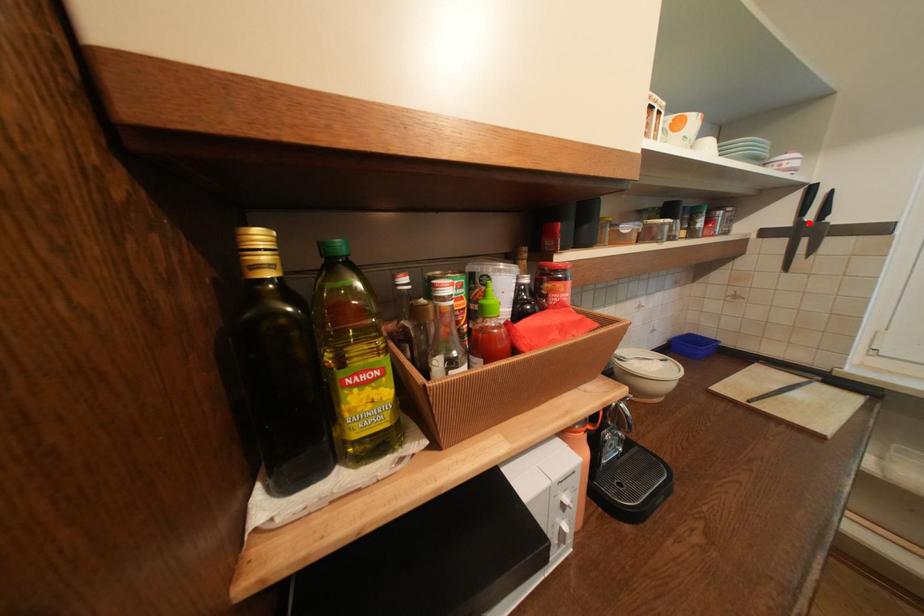
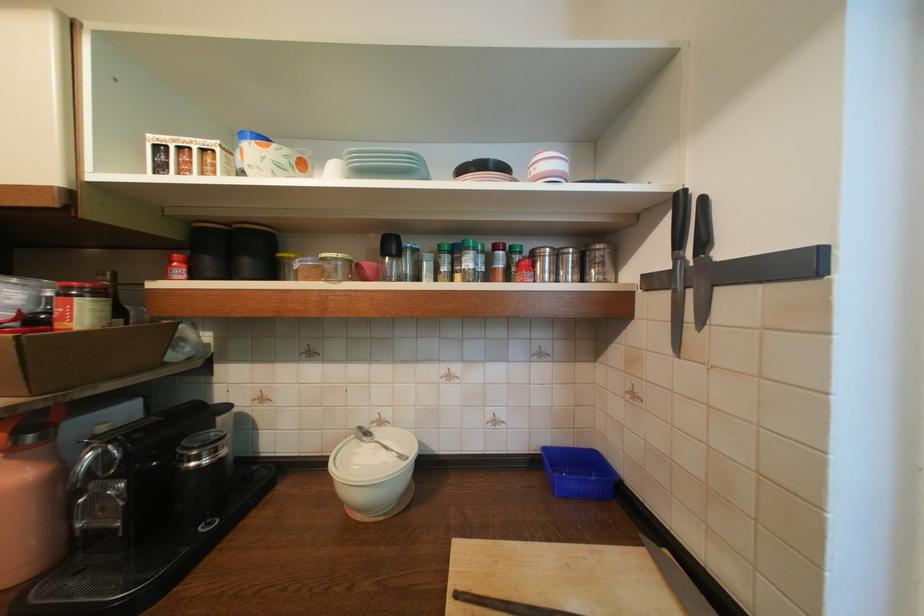
Where in the second image is the point corresponding to the highlighted location from the first image?

(686, 261)